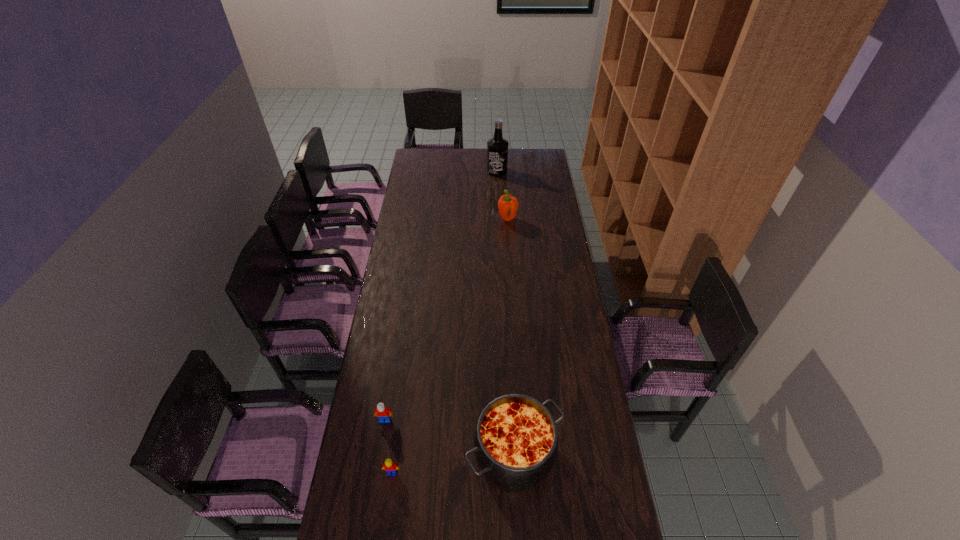
At what (x,y) coordinates should I click in order to perform the action: click on the farthest object. Please return your answer as a coordinate pair (x, y). This screenshot has height=540, width=960. Looking at the image, I should click on (497, 147).

Identify the location of the tallest object. The height and width of the screenshot is (540, 960). (497, 147).

Find the location of a particular element. This screenshot has width=960, height=540. casserole is located at coordinates (515, 443).

Where is `the fourth nearest object`? The height and width of the screenshot is (540, 960). the fourth nearest object is located at coordinates (507, 205).

Identify the location of the taller Lego. (383, 413).

Identify the location of the farther Lego. (383, 413).

At what (x,y) coordinates should I click in order to perform the action: click on the shorter Lego. Please return your answer as a coordinate pair (x, y). The height and width of the screenshot is (540, 960). Looking at the image, I should click on (390, 466).

Locate an element on the screen. This screenshot has width=960, height=540. the nearer Lego is located at coordinates (390, 466).

This screenshot has width=960, height=540. I want to click on vacant area situated 0.320m on the front label of the tallest object, so click(499, 210).

I want to click on vacant space positioned 0.140m on the back of the casserole, so click(x=510, y=382).